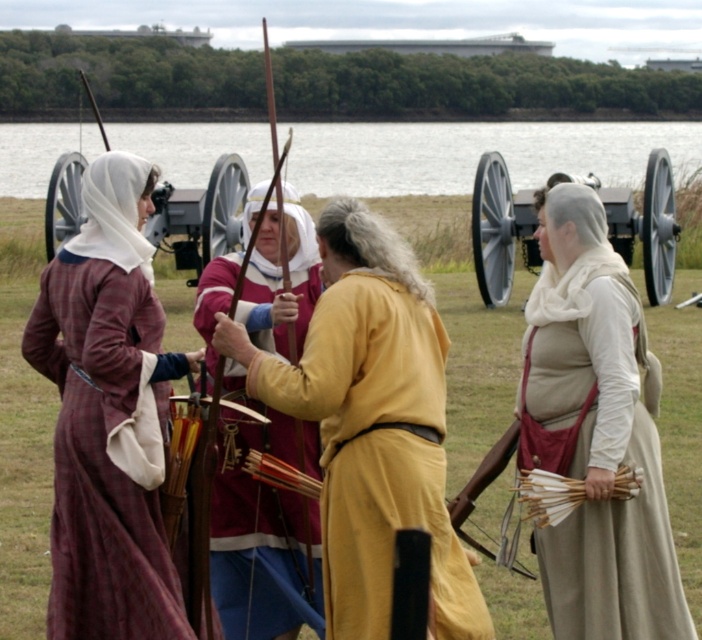
Can you confirm if golden-yellow fabric at center is smaller than maroon velvet tunic at center?

Correct, golden-yellow fabric at center occupies less space than maroon velvet tunic at center.

Looking at this image, is golden-yellow fabric at center to the right of maroon velvet tunic at center from the viewer's perspective?

Correct, you'll find golden-yellow fabric at center to the right of maroon velvet tunic at center.

Between point (477, 627) and point (227, 595), which one is positioned in front?

Point (477, 627) is in front.

At what (x,y) coordinates should I click in order to perform the action: click on golden-yellow fabric at center. Please return your answer as a coordinate pair (x, y). This screenshot has width=702, height=640. Looking at the image, I should click on (376, 451).

What do you see at coordinates (604, 564) in the screenshot?
I see `beige woolen vest at right` at bounding box center [604, 564].

Which is below, beige woolen vest at right or gray metallic cannon at center?

beige woolen vest at right

Is point (644, 630) positioned before point (552, 182)?

Yes, point (644, 630) is closer to viewer.

Find the location of a particular element. beige woolen vest at right is located at coordinates (604, 564).

Between plaid wool dress at left and beige woolen vest at right, which one appears on the right side from the viewer's perspective?

beige woolen vest at right

Can you confirm if plaid wool dress at left is positioned to the right of beige woolen vest at right?

Incorrect, plaid wool dress at left is not on the right side of beige woolen vest at right.

You are a GUI agent. You are given a task and a screenshot of the screen. Output one action in this format:
    pyautogui.click(x=<x>, y=<y>)
    Task: Click on the plaid wool dress at left
    This screenshot has width=702, height=640.
    Given the screenshot: What is the action you would take?
    pyautogui.click(x=107, y=417)